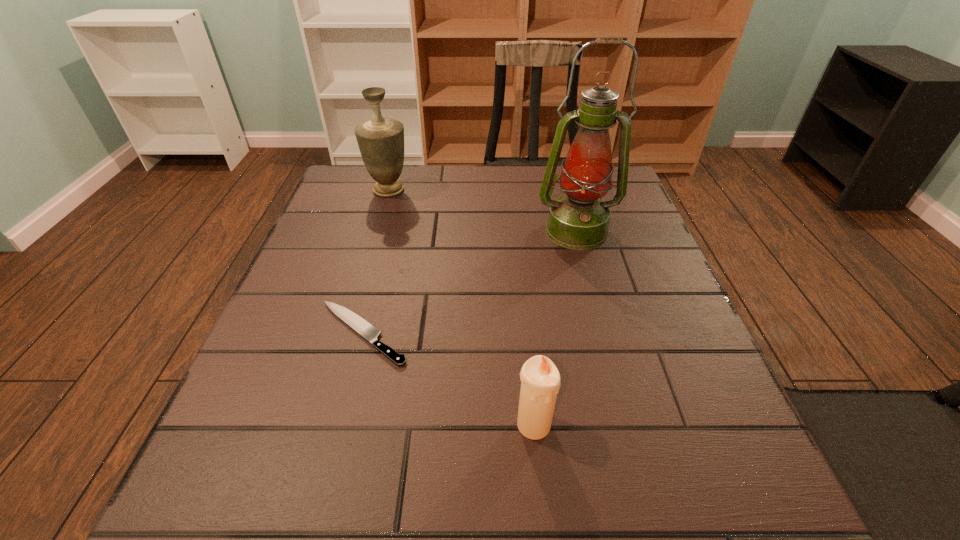
Image resolution: width=960 pixels, height=540 pixels. Find the location of `vacant space located 0.130m on the back of the candle`. vacant space located 0.130m on the back of the candle is located at coordinates (526, 343).

Locate an element on the screen. This screenshot has height=540, width=960. free space located on the back of the second nearest object is located at coordinates (386, 241).

Find the location of `object that is at the far edge`. object that is at the far edge is located at coordinates tap(381, 140).

I want to click on urn that is at the left edge, so click(x=381, y=140).

The width and height of the screenshot is (960, 540). Identify the location of steak knife that is at the left edge. (360, 325).

The width and height of the screenshot is (960, 540). Find the location of `object that is at the right edge`. object that is at the right edge is located at coordinates (579, 220).

Locate an element on the screen. object at the far left corner is located at coordinates (381, 140).

In the image, there is a desktop. Identify the location of vacant space at the far edge. (455, 182).

Locate an element on the screen. vacant space at the near edge of the desktop is located at coordinates tap(530, 491).

The height and width of the screenshot is (540, 960). In the image, there is a desktop. Find the location of `free space at the left edge`. free space at the left edge is located at coordinates (306, 442).